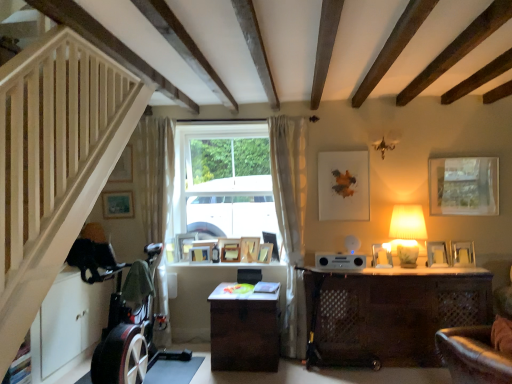
Identify the location of vacant space in front of white fabric lampshade at right. Image resolution: width=512 pixels, height=384 pixels. [x=415, y=273].